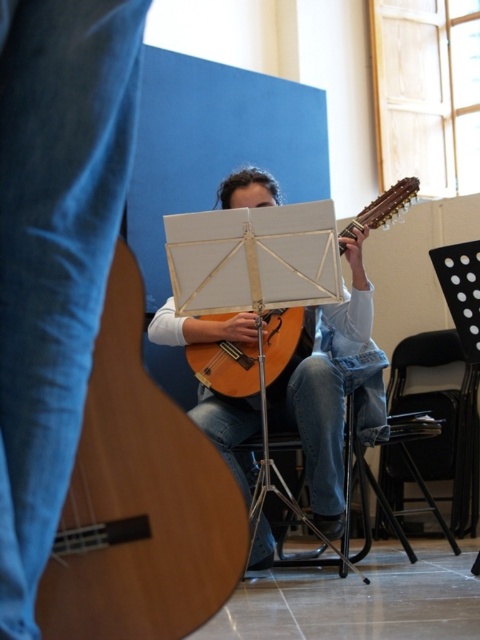
How far apart are black plastic chair at lower right and wooden acoustic guitar at center?

The distance of black plastic chair at lower right from wooden acoustic guitar at center is 1.48 meters.

Can you confirm if black plastic chair at lower right is taller than wooden acoustic guitar at center?

Yes.

Is point (436, 449) closer to camera compared to point (228, 387)?

No, (436, 449) is further to viewer.

Locate an element on the screen. Image resolution: width=480 pixels, height=640 pixels. black plastic chair at lower right is located at coordinates (442, 417).

Does black plastic chair at lower right have a greater width compared to black plastic chair at lower center?

Indeed, black plastic chair at lower right has a greater width compared to black plastic chair at lower center.

Between point (435, 349) and point (282, 442), which one is positioned behind?

The point (435, 349) is behind.

At what (x,y) coordinates should I click in order to perform the action: click on black plastic chair at lower right. Please return your answer as a coordinate pair (x, y). Looking at the image, I should click on (442, 417).

Which is more to the left, light brown wooden guitar at center or black plastic chair at lower center?

From the viewer's perspective, light brown wooden guitar at center appears more on the left side.

Does light brown wooden guitar at center have a greater height compared to black plastic chair at lower center?

Incorrect, light brown wooden guitar at center's height is not larger of black plastic chair at lower center's.

Who is more forward, (120, 593) or (257, 493)?

Point (120, 593)

In order to click on light brown wooden guitar at center in this screenshot , I will do `click(140, 500)`.